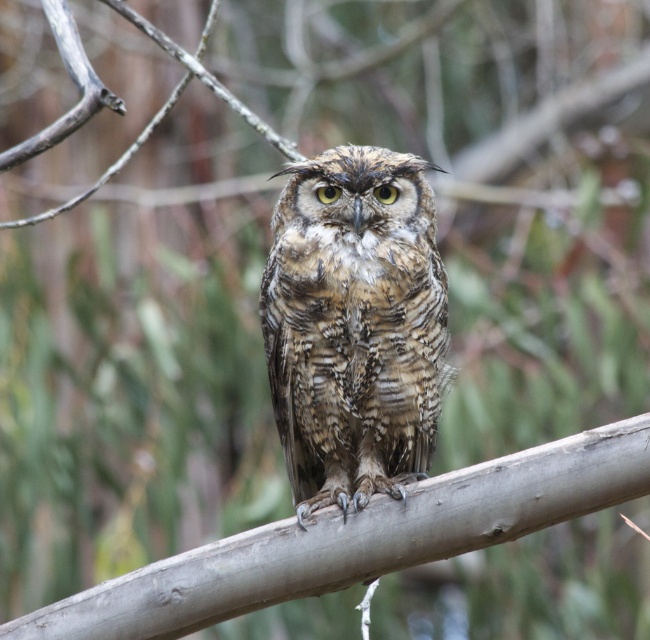
Question: Is brown textured owl at center to the right of gray smooth branch at center from the viewer's perspective?

Choices:
 (A) yes
 (B) no

Answer: (A)

Question: Among these objects, which one is farthest from the camera?

Choices:
 (A) brown textured owl at center
 (B) gray smooth branch at center

Answer: (A)

Question: Which of the following is the farthest from the observer?

Choices:
 (A) (278, 198)
 (B) (437, 556)

Answer: (A)

Question: In this image, where is brown textured owl at center located relative to gray smooth branch at center?

Choices:
 (A) above
 (B) below

Answer: (A)

Question: Is brown textured owl at center below gray smooth branch at center?

Choices:
 (A) no
 (B) yes

Answer: (A)